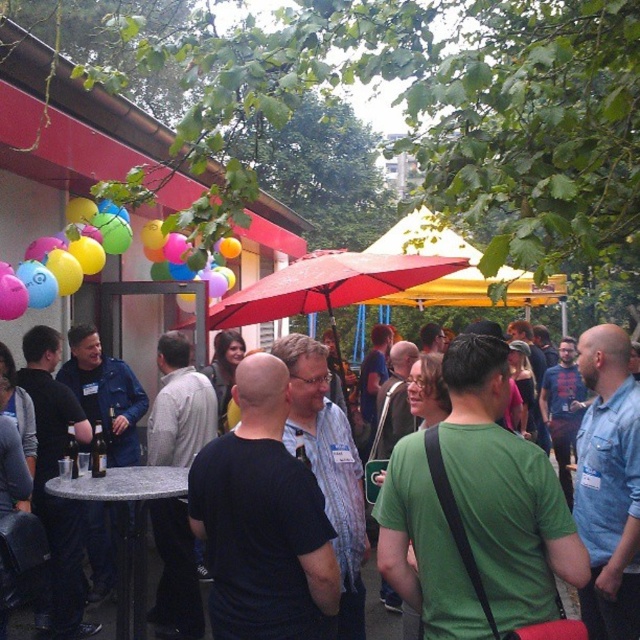
Can you confirm if red fabric umbrella at center is wider than black t-shirt at center?

Yes.

Identify the location of red fabric umbrella at center. This screenshot has height=640, width=640. (326, 285).

Describe the element at coordinates (326, 285) in the screenshot. I see `red fabric umbrella at center` at that location.

I want to click on red fabric umbrella at center, so click(326, 285).

In order to click on multicolored balloons at upper left in this screenshot , I will do `click(60, 264)`.

Who is positioned more to the left, multicolored balloons at upper left or yellow fabric canopy at center?

multicolored balloons at upper left

Between multicolored balloons at upper left and yellow fabric canopy at center, which one is positioned higher?

yellow fabric canopy at center is above.

What do you see at coordinates (60, 264) in the screenshot? I see `multicolored balloons at upper left` at bounding box center [60, 264].

Where is `multicolored balloons at upper left`? The height and width of the screenshot is (640, 640). multicolored balloons at upper left is located at coordinates (60, 264).